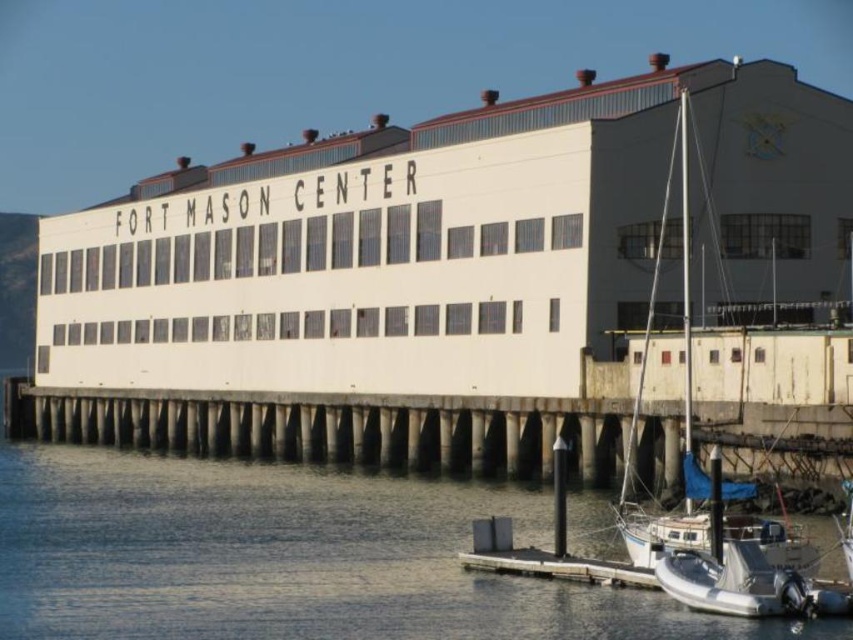
Is clear water at lower left closer to the viewer compared to white matte sailboat at lower right?

Yes, it is.

Does clear water at lower left appear over white matte sailboat at lower right?

No, clear water at lower left is not above white matte sailboat at lower right.

Locate an element on the screen. clear water at lower left is located at coordinates (291, 557).

Is point (397, 445) closer to camera compared to point (776, 536)?

No, (397, 445) is behind (776, 536).

Between concrete pillars at lower center and white matte sailboat at lower right, which one is positioned higher?

white matte sailboat at lower right

The width and height of the screenshot is (853, 640). Find the location of `concrete pillars at lower center`. concrete pillars at lower center is located at coordinates (331, 428).

Between clear water at lower left and concrete pillars at lower center, which one has more height?

concrete pillars at lower center

At what (x,y) coordinates should I click in order to perform the action: click on clear water at lower left. Please return your answer as a coordinate pair (x, y). Looking at the image, I should click on (291, 557).

Is point (233, 538) positioned in front of point (164, 435)?

Yes, it is.

Locate an element on the screen. The width and height of the screenshot is (853, 640). clear water at lower left is located at coordinates (291, 557).